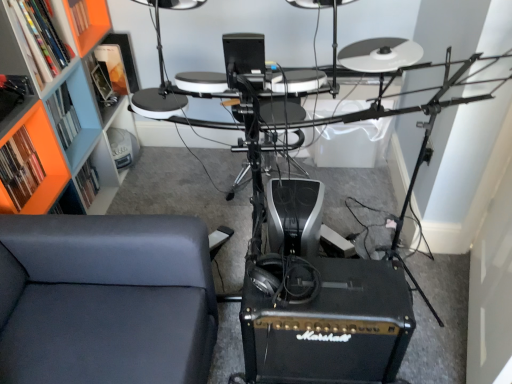
Question: Can you confirm if black leather armchair at center is taller than orange matte bookshelf at upper left, the first shelf ordered from the bottom?

Choices:
 (A) no
 (B) yes

Answer: (B)

Question: From a real-world perspective, is black leather armchair at center beneath orange matte bookshelf at upper left, the first shelf ordered from the bottom?

Choices:
 (A) no
 (B) yes

Answer: (B)

Question: Is orange matte bookshelf at upper left, the 4th shelf when ordered from top to bottom, at the back of black leather armchair at center?

Choices:
 (A) yes
 (B) no

Answer: (B)

Question: Can you confirm if black leather armchair at center is wider than orange matte bookshelf at upper left, the first shelf ordered from the bottom?

Choices:
 (A) yes
 (B) no

Answer: (A)

Question: Is black leather armchair at center behind orange matte bookshelf at upper left, the 4th shelf when ordered from top to bottom?

Choices:
 (A) yes
 (B) no

Answer: (A)

Question: From the image's perspective, is orange matte bookshelf at upper left, the 4th shelf when ordered from top to bottom, located above or below black matte marshall amplifier at lower center?

Choices:
 (A) above
 (B) below

Answer: (A)

Question: Considering the relative positions of orange matte bookshelf at upper left, the 4th shelf when ordered from top to bottom, and black matte marshall amplifier at lower center in the image provided, is orange matte bookshelf at upper left, the 4th shelf when ordered from top to bottom, to the left or to the right of black matte marshall amplifier at lower center?

Choices:
 (A) left
 (B) right

Answer: (A)

Question: Considering the positions of point (14, 205) and point (314, 266), is point (14, 205) closer or farther from the camera than point (314, 266)?

Choices:
 (A) closer
 (B) farther

Answer: (B)

Question: Considering the positions of orange matte bookshelf at upper left, the first shelf ordered from the bottom, and black matte marshall amplifier at lower center in the image, is orange matte bookshelf at upper left, the first shelf ordered from the bottom, bigger or smaller than black matte marshall amplifier at lower center?

Choices:
 (A) small
 (B) big

Answer: (A)

Question: From a real-world perspective, is black leather armchair at center physically located above or below black matte marshall amplifier at lower center?

Choices:
 (A) below
 (B) above

Answer: (B)

Question: In terms of width, does black leather armchair at center look wider or thinner when compared to black matte marshall amplifier at lower center?

Choices:
 (A) thin
 (B) wide

Answer: (B)

Question: Is black leather armchair at center to the left or to the right of black matte marshall amplifier at lower center in the image?

Choices:
 (A) left
 (B) right

Answer: (A)

Question: Does point (257, 114) appear closer or farther from the camera than point (394, 292)?

Choices:
 (A) farther
 (B) closer

Answer: (A)

Question: Considering the positions of orange matte bookshelf at upper left, the second shelf from the bottom, and suede-like gray chair at lower left in the image, is orange matte bookshelf at upper left, the second shelf from the bottom, wider or thinner than suede-like gray chair at lower left?

Choices:
 (A) thin
 (B) wide

Answer: (A)

Question: From the image's perspective, relative to suede-like gray chair at lower left, is orange matte bookshelf at upper left, the third shelf positioned from the top, above or below?

Choices:
 (A) below
 (B) above

Answer: (B)